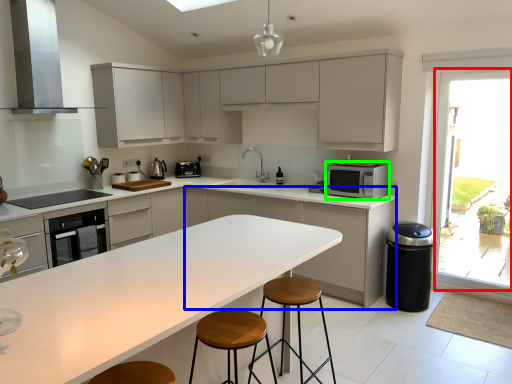
Question: Considering the real-world distances, which object is farthest from window (highlighted by a red box)? cabinetry (highlighted by a blue box) or microwave oven (highlighted by a green box)?

Choices:
 (A) cabinetry
 (B) microwave oven

Answer: (A)